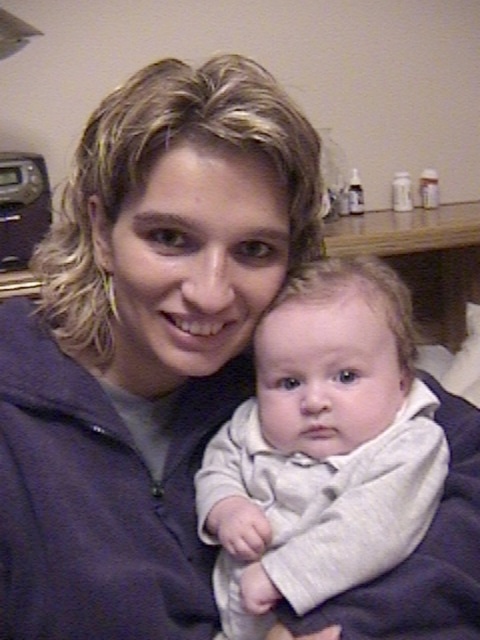
Question: Which object appears farthest from the camera in this image?

Choices:
 (A) white soft baby at center
 (B) dark blue fleece at center

Answer: (A)

Question: Is dark blue fleece at center below white soft baby at center?

Choices:
 (A) yes
 (B) no

Answer: (B)

Question: Which point is closer to the camera?

Choices:
 (A) white soft baby at center
 (B) dark blue fleece at center

Answer: (B)

Question: Among these objects, which one is nearest to the camera?

Choices:
 (A) white soft baby at center
 (B) dark blue fleece at center

Answer: (B)

Question: Is dark blue fleece at center below white soft baby at center?

Choices:
 (A) yes
 (B) no

Answer: (B)

Question: Can you confirm if dark blue fleece at center is bigger than white soft baby at center?

Choices:
 (A) yes
 (B) no

Answer: (A)